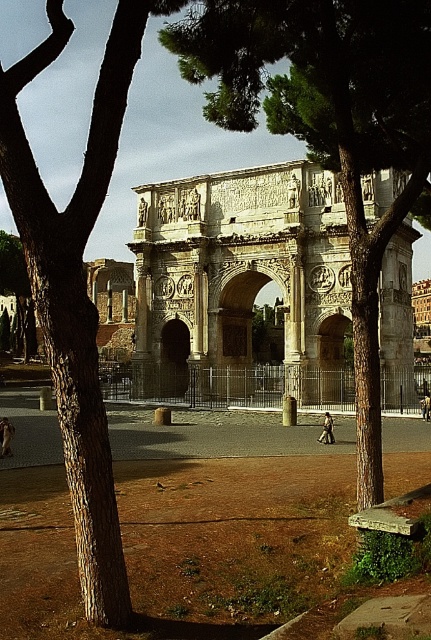
You are standing in front of the Arch of Constantine and want to take a photo of it. There is a green leafy tree at center in the way. Where should you move to get a clear view of the Arch of Constantine without the tree blocking it?

Since the green leafy tree at center is located at point (328, 128), moving to the left or right of that position would allow you to avoid the tree and get a clear view of the Arch of Constantine.